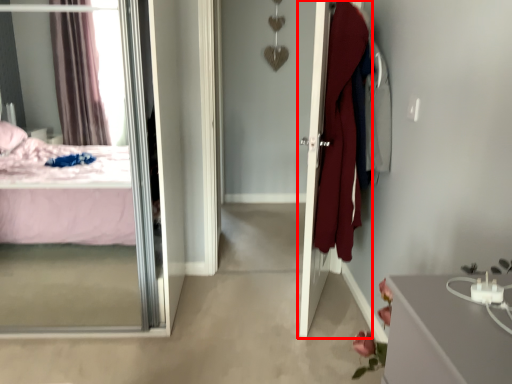
Question: Observing the image, what is the correct spatial positioning of door (annotated by the red box) in reference to mirror?

Choices:
 (A) left
 (B) right

Answer: (B)